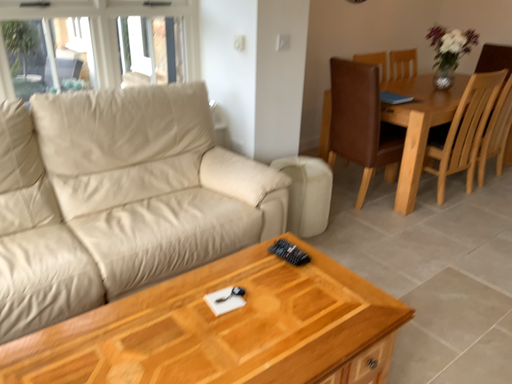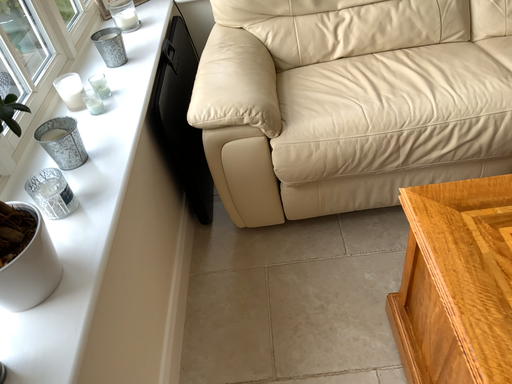
Question: How did the camera likely rotate when shooting the video?

Choices:
 (A) rotated upward
 (B) rotated downward

Answer: (B)